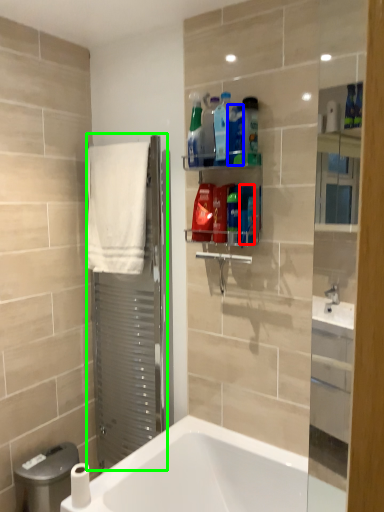
Question: Based on their relative distances, which object is farther from cleaning product (highlighted by a red box)? Choose from product (highlighted by a blue box) and screen door (highlighted by a green box).

Choices:
 (A) product
 (B) screen door

Answer: (B)